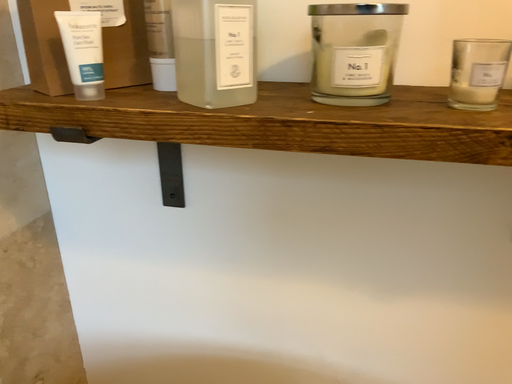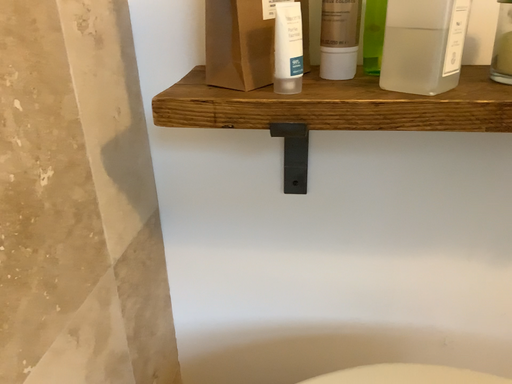
Question: How did the camera likely rotate when shooting the video?

Choices:
 (A) rotated right
 (B) rotated left

Answer: (A)